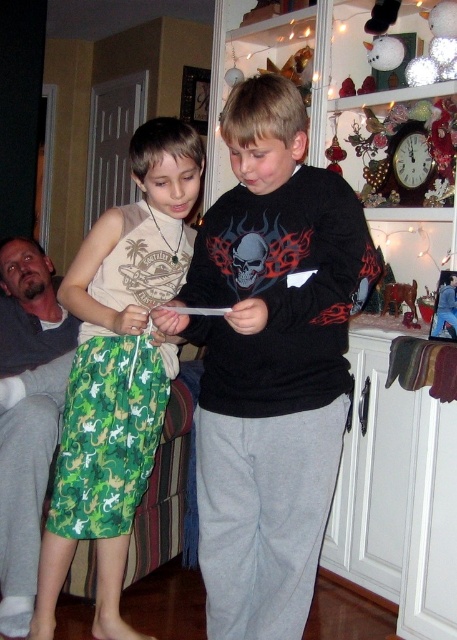
You are a photographer trying to capture a clear photo of the green camouflage shorts at left and the gray fabric pants at lower left. Since you want both subjects to be in focus, which one should you adjust your camera focus on first?

The green camouflage shorts at left is in front of gray fabric pants at lower left, so you should focus on the green camouflage shorts at left first to ensure both are in focus.

You are a tailor measuring clothing for two customers. The first customer is wearing green camouflage shorts at left, and the second is wearing gray fabric pants at lower left. Which clothing item requires more fabric to make a similar size?

The green camouflage shorts at left requires more fabric because it has a larger size compared to the gray fabric pants at lower left.

You are a photographer setting up for a group photo. You need to ensure all subjects are visible. The black matte sweatshirt at center and gray fabric pants at lower left are in your frame. Which object should you adjust to avoid being too small in the shot?

The black matte sweatshirt at center is smaller than the gray fabric pants at lower left, so you should adjust the black matte sweatshirt at center to make it larger in the frame to ensure visibility.